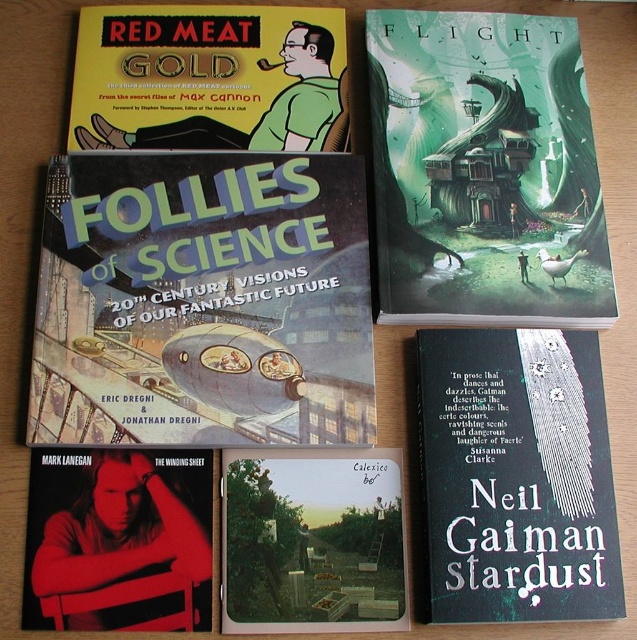
Question: Is matte blue book at center positioned at the back of matte cardboard album at center?

Choices:
 (A) yes
 (B) no

Answer: (A)

Question: Can you confirm if black matte book at lower right is wider than matte cardboard album at center?

Choices:
 (A) yes
 (B) no

Answer: (A)

Question: Based on their relative distances, which object is farther from the black matte book at lower right?

Choices:
 (A) matte blue book at center
 (B) matte cardboard album at center

Answer: (A)

Question: In this image, where is green matte house at upper center located relative to matte yellow book at upper left?

Choices:
 (A) left
 (B) right

Answer: (B)

Question: Among these objects, which one is nearest to the camera?

Choices:
 (A) green matte house at upper center
 (B) black matte book at lower right
 (C) matte blue book at center

Answer: (B)

Question: Among these points, which one is nearest to the camera?

Choices:
 (A) pyautogui.click(x=308, y=609)
 (B) pyautogui.click(x=304, y=104)

Answer: (A)